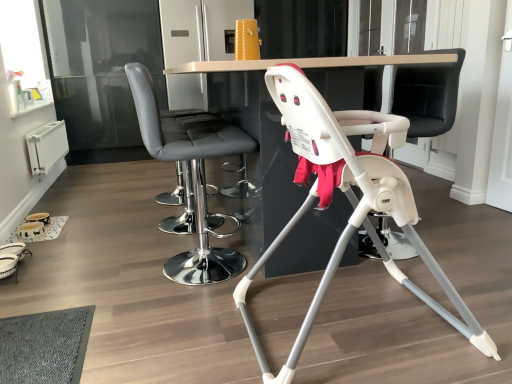
Find the location of a particular element. The width and height of the screenshot is (512, 384). free space in front of white plastic swivel chair at center is located at coordinates (432, 277).